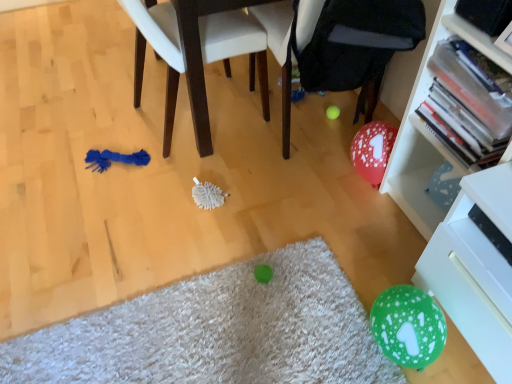
Question: Does white glossy drawer at lower right have a smaller size compared to blue fabric chair at left?

Choices:
 (A) no
 (B) yes

Answer: (B)

Question: Considering the relative sizes of white glossy drawer at lower right and blue fabric chair at left in the image provided, is white glossy drawer at lower right shorter than blue fabric chair at left?

Choices:
 (A) no
 (B) yes

Answer: (B)

Question: Is white glossy drawer at lower right bigger than blue fabric chair at left?

Choices:
 (A) no
 (B) yes

Answer: (A)

Question: Could you tell me if white glossy drawer at lower right is turned towards blue fabric chair at left?

Choices:
 (A) no
 (B) yes

Answer: (A)

Question: From a real-world perspective, does white glossy drawer at lower right sit lower than blue fabric chair at left?

Choices:
 (A) no
 (B) yes

Answer: (B)

Question: Considering the positions of point (138, 46) and point (419, 266), is point (138, 46) closer or farther from the camera than point (419, 266)?

Choices:
 (A) farther
 (B) closer

Answer: (A)

Question: From a real-world perspective, is blue fabric chair at left physically located above or below white glossy drawer at lower right?

Choices:
 (A) above
 (B) below

Answer: (A)

Question: In terms of width, does blue fabric chair at left look wider or thinner when compared to white glossy drawer at lower right?

Choices:
 (A) wide
 (B) thin

Answer: (A)

Question: Choose the correct answer: Is blue fabric chair at left inside white glossy drawer at lower right or outside it?

Choices:
 (A) inside
 (B) outside

Answer: (B)

Question: Is point (437, 16) positioned closer to the camera than point (168, 150)?

Choices:
 (A) closer
 (B) farther

Answer: (A)

Question: Is white plastic bookcase at right bigger or smaller than blue fabric chair at left?

Choices:
 (A) small
 (B) big

Answer: (A)

Question: From a real-world perspective, is white plastic bookcase at right positioned above or below blue fabric chair at left?

Choices:
 (A) above
 (B) below

Answer: (A)

Question: Is white plastic bookcase at right wider or thinner than blue fabric chair at left?

Choices:
 (A) wide
 (B) thin

Answer: (B)

Question: Would you say green fuzzy mat at lower center is inside or outside white plastic bookcase at right?

Choices:
 (A) outside
 (B) inside

Answer: (A)

Question: Considering the positions of point (102, 357) and point (404, 201), is point (102, 357) closer or farther from the camera than point (404, 201)?

Choices:
 (A) closer
 (B) farther

Answer: (A)